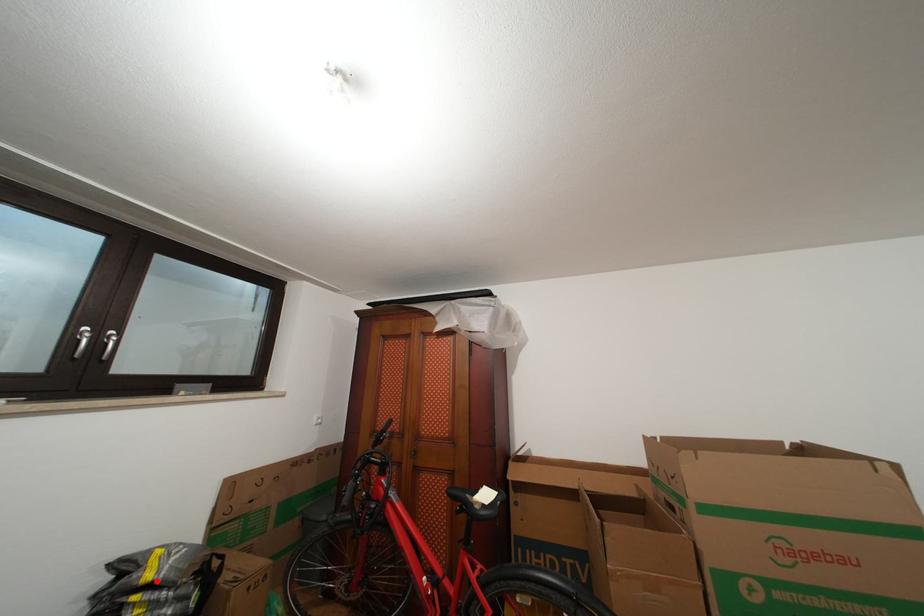
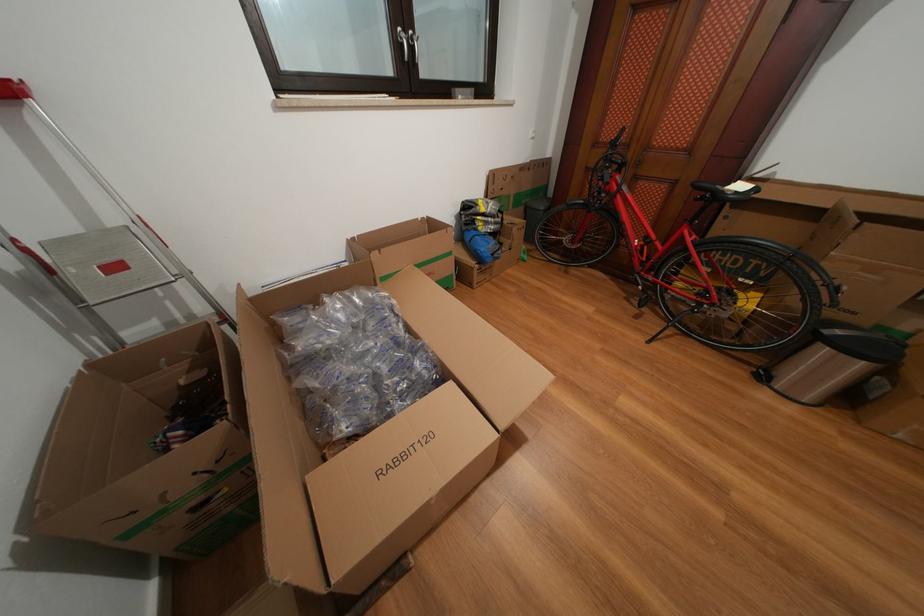
Question: I am providing you with two images of the same scene from different viewpoints. In image1, a red point is highlighted. Considering the same 3D point in image2, which of the following is correct?

Choices:
 (A) It is closer
 (B) It is farther

Answer: (B)